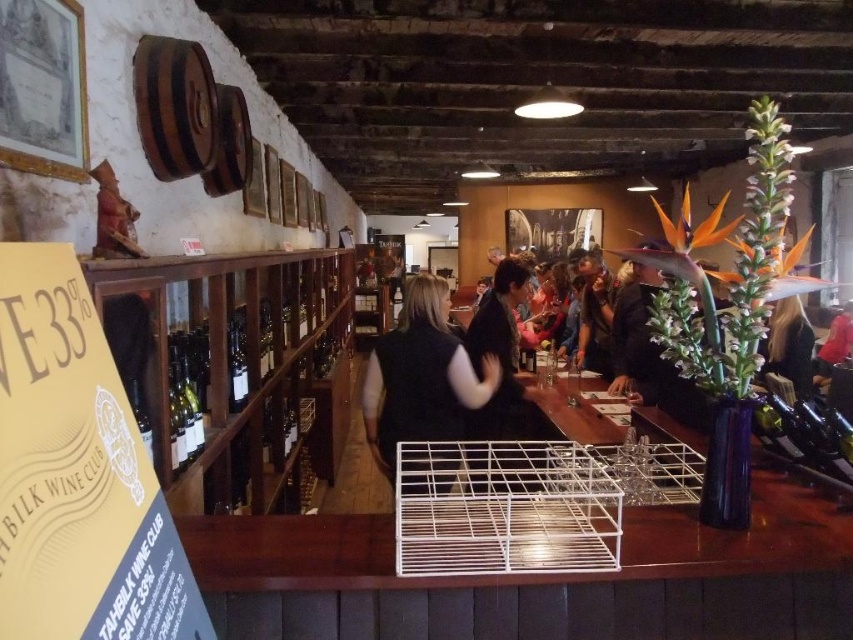
Question: Which object is closer to the camera taking this photo?

Choices:
 (A) black fabric jacket at center
 (B) white wire cage at center

Answer: (B)

Question: Can you confirm if black fabric vest at center is positioned to the right of black fabric jacket at center?

Choices:
 (A) yes
 (B) no

Answer: (B)

Question: Can you confirm if matte black jacket at center is positioned to the right of green glass bottle at center?

Choices:
 (A) no
 (B) yes

Answer: (B)

Question: Which object is farther from the camera taking this photo?

Choices:
 (A) white wire cage at center
 (B) translucent glass bottle at center
 (C) shiny gold wine bottle at center
 (D) matte black jacket at center

Answer: (D)

Question: Which point is farther from the camera taking this photo?

Choices:
 (A) (134, 401)
 (B) (228, 332)
 (C) (265, 344)

Answer: (C)

Question: Can you confirm if black fabric jacket at center is positioned above matte black jacket at center?

Choices:
 (A) no
 (B) yes

Answer: (A)